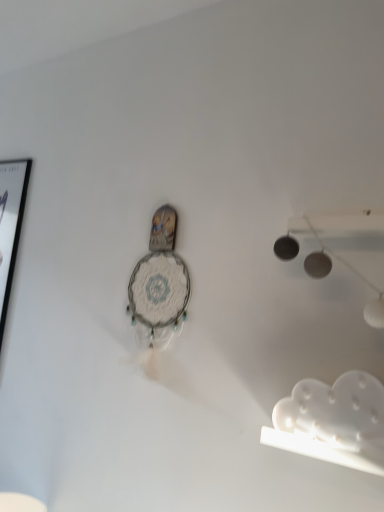
Question: Considering the positions of white matte cloud at lower right and black glossy picture frame at left in the image, is white matte cloud at lower right taller or shorter than black glossy picture frame at left?

Choices:
 (A) short
 (B) tall

Answer: (A)

Question: Is point (342, 462) closer or farther from the camera than point (1, 233)?

Choices:
 (A) farther
 (B) closer

Answer: (B)

Question: Considering the real-world distances, which object is farthest from the white lace clock at center?

Choices:
 (A) black glossy picture frame at left
 (B) white matte cloud at lower right

Answer: (A)

Question: Estimate the real-world distances between objects in this image. Which object is closer to the black glossy picture frame at left?

Choices:
 (A) white lace clock at center
 (B) white matte cloud at lower right

Answer: (A)